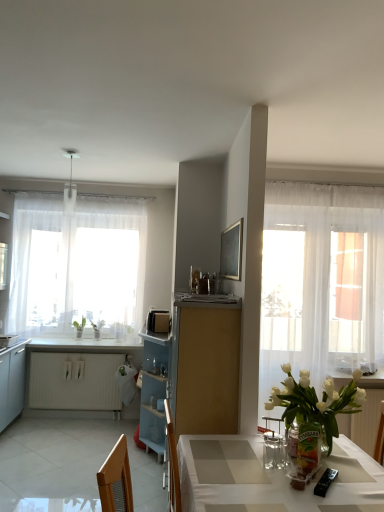
Question: Visually, is white glossy microwave at left, acting as the 2th appliance starting from the back, positioned to the left or to the right of transparent glass vase at center-right?

Choices:
 (A) right
 (B) left

Answer: (B)

Question: From the image's perspective, is white glossy microwave at left, marked as the 1th appliance in a left-to-right arrangement, located above or below transparent glass vase at center-right?

Choices:
 (A) below
 (B) above

Answer: (A)

Question: Which object is the closest to the white fabric table at lower right?

Choices:
 (A) white matte radiator at lower left, positioned as the third cabinetry in front-to-back order
 (B) matte wood cabinet at center, which is the 1th cabinetry from right to left
 (C) white sheer curtain at left
 (D) sheer white curtain at right
 (E) light blue plastic cabinet at center, the second cabinetry positioned from the left

Answer: (B)

Question: Estimate the real-world distances between objects in this image. Which object is closer to the sheer white curtain at right?

Choices:
 (A) white matte radiator at lower left, positioned as the third cabinetry in front-to-back order
 (B) white fabric table at lower right
 (C) transparent glass vase at center-right
 (D) white sheer curtain at left
 (E) white glossy counter top at lower left

Answer: (B)